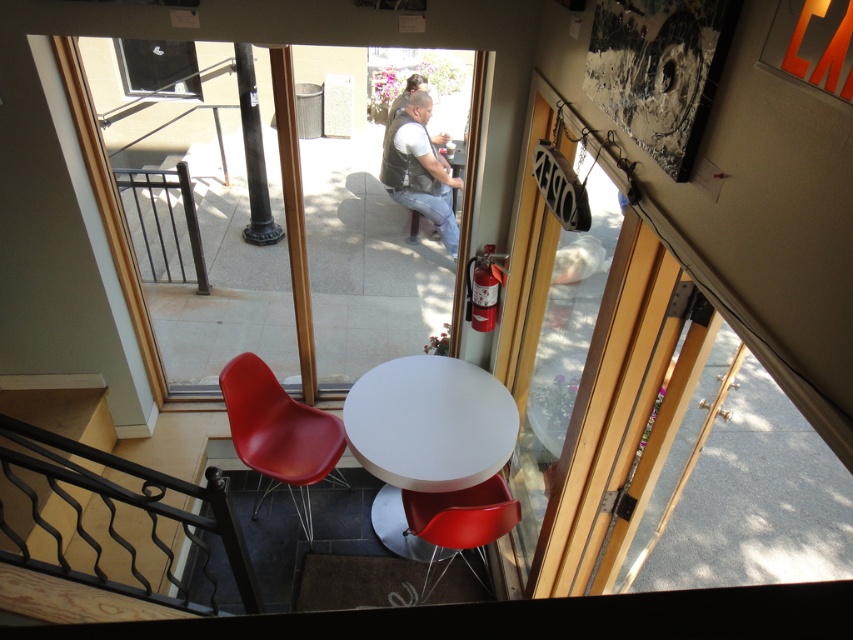
You are a delivery person trying to place a large package on the white glossy table at center. The package is 3 meters long. Can you fit the package on the table without it overlapping the leather vest at center?

The distance between the white glossy table at center and the leather vest at center is 2.74 meters. Since the package is 3 meters long, it would extend beyond the available space between them, so it cannot be placed without overlapping.

You are standing at the point with coordinates (279, 433) in the image. What object is located at that point?

The point corresponds to the glossy plastic chair at lower left.

You are a delivery person trying to enter the outdoor seating area through the transparent glass door at center. The white glossy table at center is blocking your path. Can you walk around the table to reach the door?

The transparent glass door at center is larger in size than the white glossy table at center, so the door is wider. Since the door is wider, you can walk around the table at the sides to reach the door.